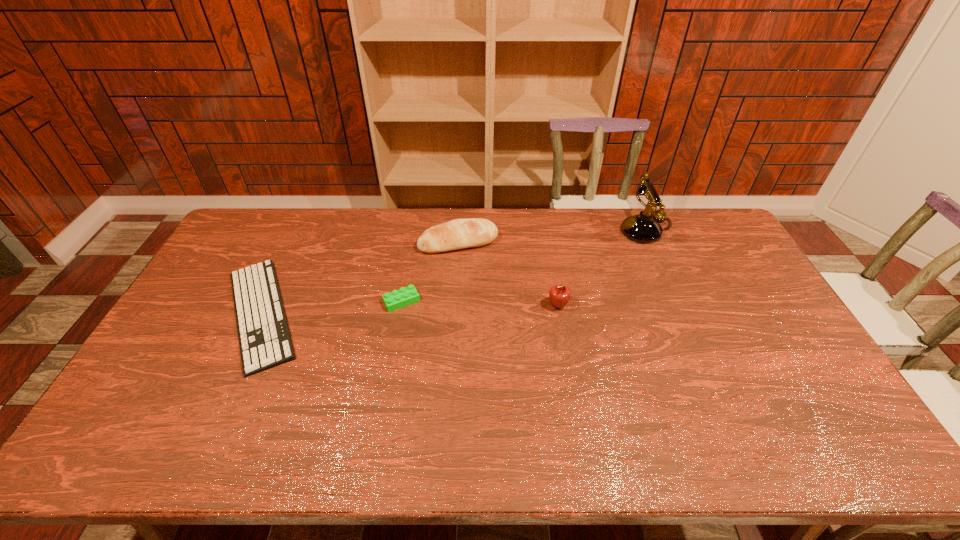
Identify the location of unoccupied area between the bread and the computer keyboard. Image resolution: width=960 pixels, height=540 pixels. (359, 278).

Point out which object is positioned as the fourth nearest to the computer keyboard. Please provide its 2D coordinates. Your answer should be formatted as a tuple, i.e. [(x, y)], where the tuple contains the x and y coordinates of a point satisfying the conditions above.

[(643, 228)]

What are the coordinates of `object that is the third closest to the leftmost object` in the screenshot? It's located at (559, 295).